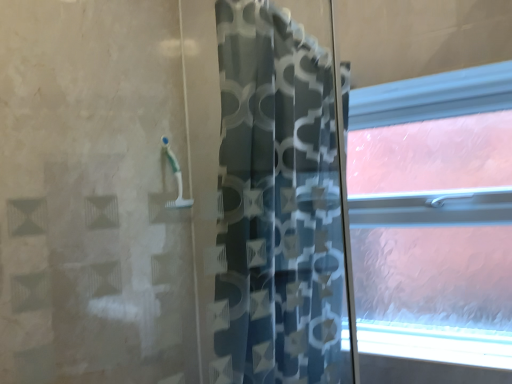
Question: From a real-world perspective, is white frosted glass at lower right beneath frosted glass window at right?

Choices:
 (A) yes
 (B) no

Answer: (A)

Question: Does white frosted glass at lower right have a greater height compared to frosted glass window at right?

Choices:
 (A) no
 (B) yes

Answer: (A)

Question: Is white frosted glass at lower right positioned beyond the bounds of frosted glass window at right?

Choices:
 (A) no
 (B) yes

Answer: (B)

Question: Is the surface of white frosted glass at lower right in direct contact with frosted glass window at right?

Choices:
 (A) yes
 (B) no

Answer: (B)

Question: Does white frosted glass at lower right appear on the right side of frosted glass window at right?

Choices:
 (A) no
 (B) yes

Answer: (A)

Question: Choose the correct answer: Is white frosted glass at lower right inside blue patterned curtain at center or outside it?

Choices:
 (A) inside
 (B) outside

Answer: (B)

Question: In terms of size, does white frosted glass at lower right appear bigger or smaller than blue patterned curtain at center?

Choices:
 (A) small
 (B) big

Answer: (A)

Question: Is white frosted glass at lower right to the left or to the right of blue patterned curtain at center in the image?

Choices:
 (A) left
 (B) right

Answer: (B)

Question: Considering the positions of point (490, 337) and point (253, 347), is point (490, 337) closer or farther from the camera than point (253, 347)?

Choices:
 (A) closer
 (B) farther

Answer: (B)

Question: Is point (395, 145) closer or farther from the camera than point (241, 89)?

Choices:
 (A) farther
 (B) closer

Answer: (A)

Question: From the image's perspective, is frosted glass window at right located above or below blue patterned curtain at center?

Choices:
 (A) below
 (B) above

Answer: (B)

Question: Based on their sizes in the image, would you say frosted glass window at right is bigger or smaller than blue patterned curtain at center?

Choices:
 (A) small
 (B) big

Answer: (A)

Question: Is frosted glass window at right inside the boundaries of blue patterned curtain at center, or outside?

Choices:
 (A) inside
 (B) outside

Answer: (B)

Question: Do you think white frosted glass at lower right is within frosted glass window at right, or outside of it?

Choices:
 (A) inside
 (B) outside

Answer: (B)

Question: Is white frosted glass at lower right wider or thinner than frosted glass window at right?

Choices:
 (A) wide
 (B) thin

Answer: (A)